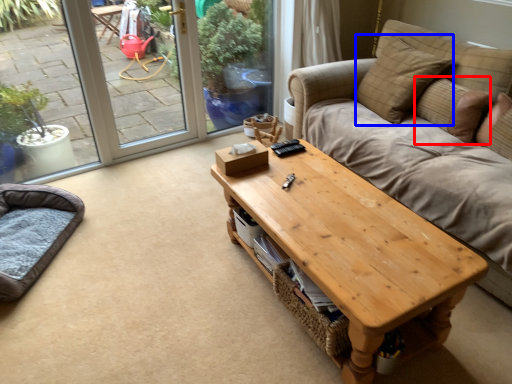
Question: Which point is closer to the camera, pillow (highlighted by a red box) or pillow (highlighted by a blue box)?

Choices:
 (A) pillow
 (B) pillow

Answer: (A)